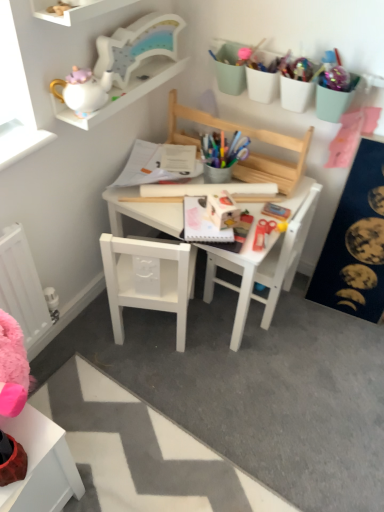
You are a GUI agent. You are given a task and a screenshot of the screen. Output one action in this format:
    pyautogui.click(x=<x>, y=<y>)
    Task: Click on the empty space that is in between dark blue fabric bulletin board at right and white wooden chair at center, arranged as the 1th chair when viewed from the right
    Image resolution: width=384 pixels, height=512 pixels.
    Given the screenshot: What is the action you would take?
    pyautogui.click(x=306, y=318)